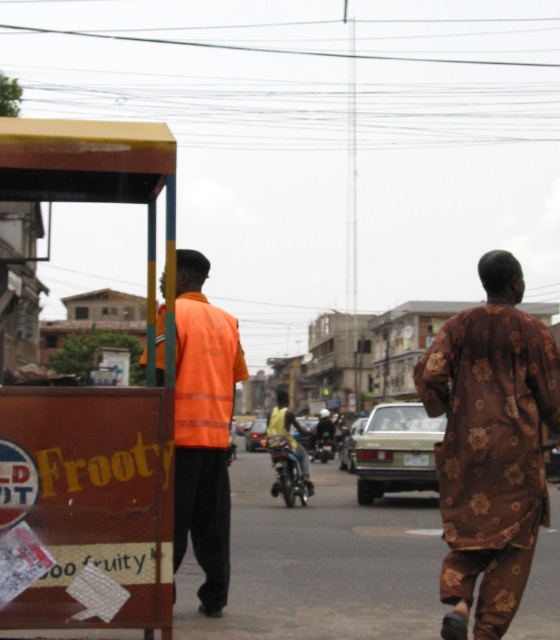
You are a pedestrian standing on the sidewalk and see the brown floral fabric robe at right and the yellow metallic motorcycle at center. Which object is higher from the ground?

The brown floral fabric robe at right is above the yellow metallic motorcycle at center, so it is higher from the ground.

You are a pedestrian standing on the sidewalk and see the brown floral fabric robe at right and the yellow metallic motorcycle at center. Which object is nearer to you?

The brown floral fabric robe at right is closer to the viewer than the yellow metallic motorcycle at center.